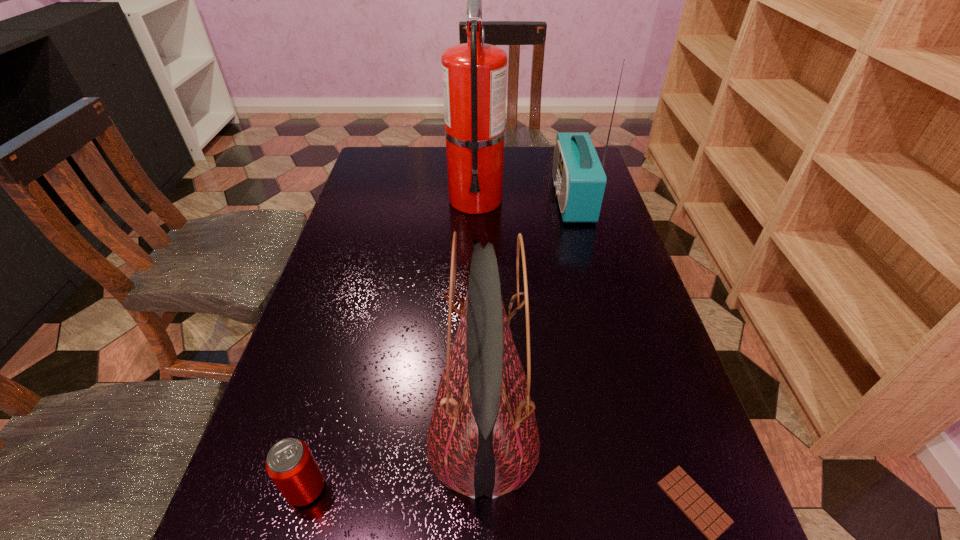
I want to click on fire extinguisher, so click(x=474, y=74).

In order to click on radio receiver in this screenshot , I will do `click(578, 176)`.

This screenshot has width=960, height=540. What are the coordinates of `the fourth tallest object` in the screenshot? It's located at (290, 464).

Locate an element on the screen. The image size is (960, 540). can is located at coordinates (290, 464).

Locate an element on the screen. The width and height of the screenshot is (960, 540). vacant space located 0.090m at the nozzle of the fire extinguisher is located at coordinates (475, 241).

Where is `vacant area situated 0.090m on the front panel of the radio receiver`? Image resolution: width=960 pixels, height=540 pixels. vacant area situated 0.090m on the front panel of the radio receiver is located at coordinates (523, 199).

Find the location of a particular element. vacant space situated 0.140m on the front panel of the radio receiver is located at coordinates (506, 199).

Where is `vacant space located on the front panel of the radio receiver`? The width and height of the screenshot is (960, 540). vacant space located on the front panel of the radio receiver is located at coordinates (480, 199).

At what (x,y) coordinates should I click in order to perform the action: click on vacant space located 0.340m on the back of the can. Please return your answer as a coordinate pair (x, y). Image resolution: width=960 pixels, height=540 pixels. Looking at the image, I should click on (354, 316).

Identify the location of fire extinguisher situated at the far edge. The image size is (960, 540). (474, 74).